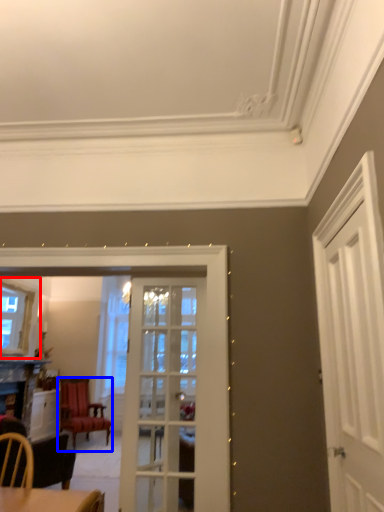
Question: Which object is closer to the camera taking this photo, window (highlighted by a red box) or chair (highlighted by a blue box)?

Choices:
 (A) window
 (B) chair

Answer: (A)